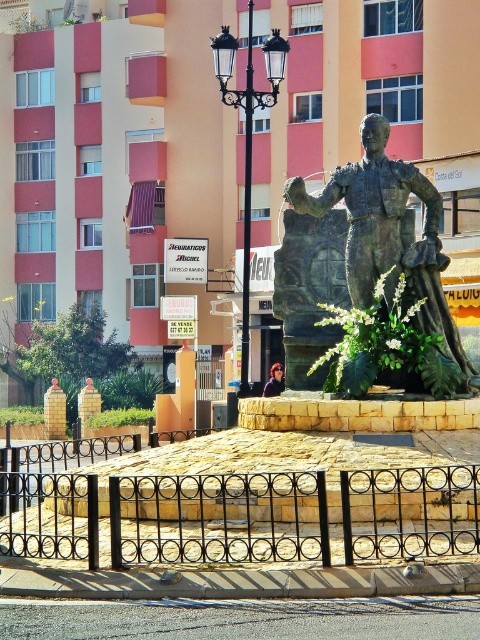
You are standing in front of the bronze statue of a man on a stone pedestal surrounded by a black metal fence. You want to take a photo of the statue from a point that is exactly 67.51 meters away. Can you confirm if the point at coordinates point (252, 38) is the correct location?

Yes, the point at coordinates point (252, 38) is exactly 67.51 meters away from the viewer, making it the correct location to take the photo.

You are standing in front of the bronze statue of a bullfighter. You see two points marked on the statue. Which point is closer to you, point (256,97) or point (277,387)?

Point (256,97) is closer to the viewer than point (277,387).

You are standing in front of the statue and want to take a photo of the shiny red hair at center with the black metal streetlight at center in the background. Which direction should you face to ensure the streetlight is behind the hair?

You should face to the right of the shiny red hair at center so that the black metal streetlight at center, which is to the left of the hair, appears in the background.